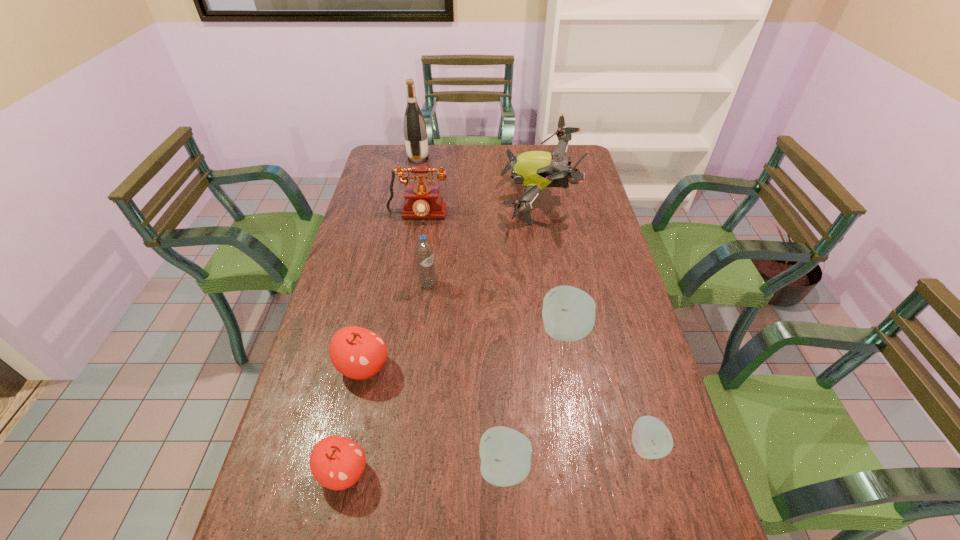
Where is `vacant space situated 0.080m on the right of the water bottle`? vacant space situated 0.080m on the right of the water bottle is located at coordinates (462, 285).

The height and width of the screenshot is (540, 960). In order to click on vacant position located on the back of the second white apple from left to right in this screenshot , I will do `click(558, 289)`.

Locate an element on the screen. The height and width of the screenshot is (540, 960). vacant space located on the back of the farther red apple is located at coordinates (375, 314).

Where is `vacant space located on the left of the third apple from left to right`? vacant space located on the left of the third apple from left to right is located at coordinates (301, 468).

The width and height of the screenshot is (960, 540). Identify the location of free location located 0.200m on the right of the nearer red apple. (460, 472).

Where is `blank space located on the front of the shortest object`? This screenshot has height=540, width=960. blank space located on the front of the shortest object is located at coordinates (670, 533).

Locate an element on the screen. This screenshot has height=540, width=960. wine bottle situated at the far edge is located at coordinates (415, 132).

Locate an element on the screen. drone that is at the far edge is located at coordinates (536, 170).

This screenshot has height=540, width=960. I want to click on wine bottle located at the left edge, so click(415, 132).

You are a GUI agent. You are given a task and a screenshot of the screen. Output one action in this format:
    pyautogui.click(x=<x>, y=<y>)
    Task: Click on the telephone at the left edge
    Image resolution: width=960 pixels, height=540 pixels.
    Given the screenshot: What is the action you would take?
    pyautogui.click(x=421, y=201)